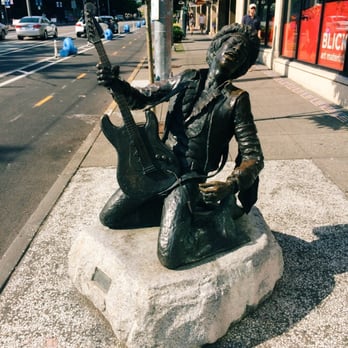
Locate an element on the screen. plaque is located at coordinates (102, 278).